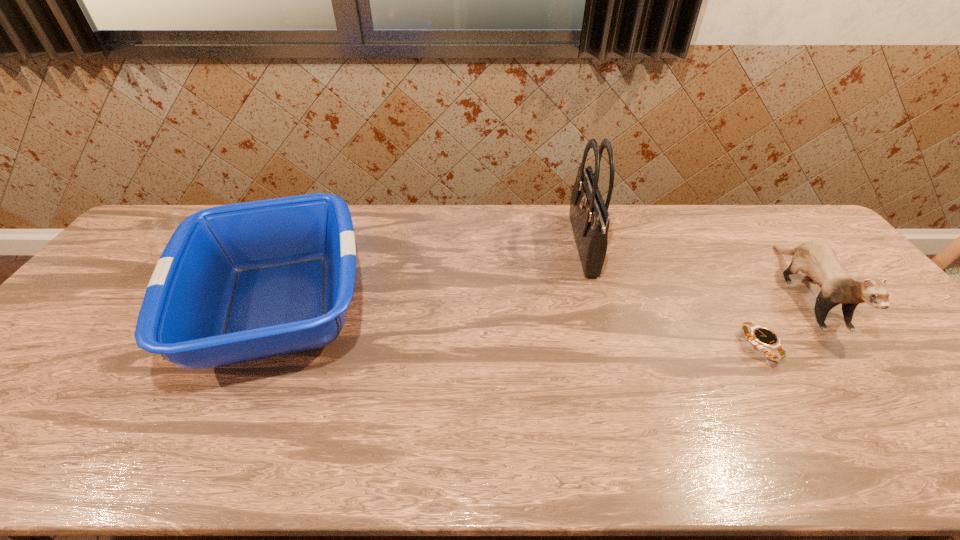
At what (x,y) coordinates should I click in order to perform the action: click on the third object from right to left. Please return your answer as a coordinate pair (x, y). Image resolution: width=960 pixels, height=540 pixels. Looking at the image, I should click on (589, 215).

Locate an element on the screen. The height and width of the screenshot is (540, 960). handbag is located at coordinates (589, 215).

Identify the location of the leftmost object. The image size is (960, 540). (235, 283).

The height and width of the screenshot is (540, 960). I want to click on ferret, so click(x=818, y=260).

Identify the location of the shortest object. Image resolution: width=960 pixels, height=540 pixels. (759, 336).

Identify the location of the second object from right to left. This screenshot has height=540, width=960. (759, 336).

Identify the location of vacant space situated 0.130m with an open clasp on the front of the second object from left to right. The width and height of the screenshot is (960, 540). (533, 247).

Where is `free space located with an open clasp on the front of the second object from left to right`? The height and width of the screenshot is (540, 960). free space located with an open clasp on the front of the second object from left to right is located at coordinates (541, 247).

Find the location of a particular element. free location located 0.140m with an open clasp on the front of the second object from left to right is located at coordinates (529, 247).

Find the location of a particular element. This screenshot has width=960, height=540. vacant space located on the back of the tray is located at coordinates (324, 205).